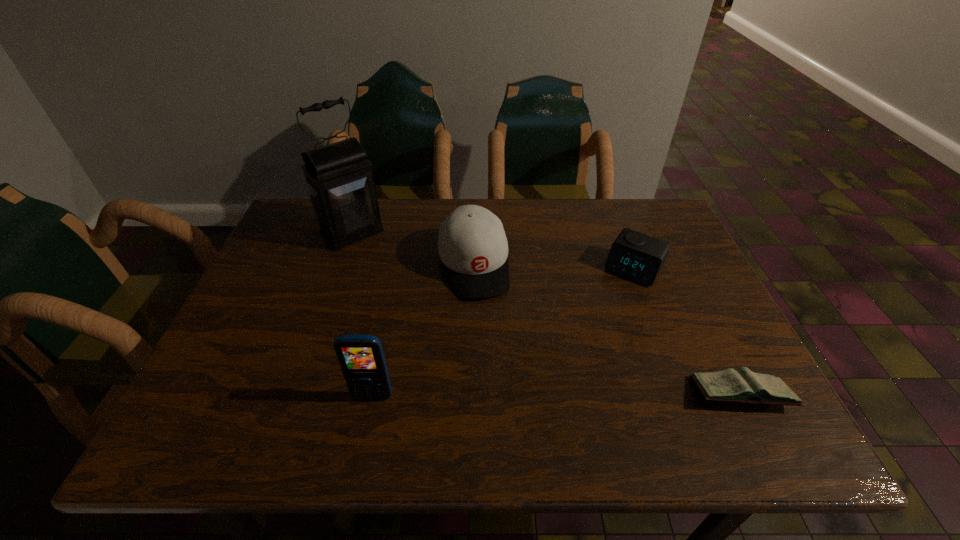
Where is `cellular telephone at the near edge`? This screenshot has width=960, height=540. cellular telephone at the near edge is located at coordinates (361, 357).

This screenshot has height=540, width=960. Find the location of `diary at the near edge`. diary at the near edge is located at coordinates (743, 386).

Where is `object positioned at the left edge`? This screenshot has height=540, width=960. object positioned at the left edge is located at coordinates pyautogui.click(x=340, y=183).

The width and height of the screenshot is (960, 540). Find the location of `diary present at the right edge`. diary present at the right edge is located at coordinates (743, 386).

You are a GUI agent. You are given a task and a screenshot of the screen. Output one action in this format:
    pyautogui.click(x=<x>, y=<y>)
    Task: Click on the alarm clock that is at the right edge
    The image size is (960, 540).
    Given the screenshot: What is the action you would take?
    pyautogui.click(x=633, y=255)

The width and height of the screenshot is (960, 540). Identify the location of object that is at the far left corner. (340, 183).

Locate an element on the screen. This screenshot has width=960, height=540. object situated at the near right corner is located at coordinates (743, 386).

Where is `vacant space at the far edge of the desktop`? vacant space at the far edge of the desktop is located at coordinates (554, 241).

At what (x,y) coordinates should I click in order to perform the action: click on vacant position at the left edge of the desktop. Please return your answer as a coordinate pair (x, y). Looking at the image, I should click on (262, 292).

At what (x,y) coordinates should I click in order to perform the action: click on vacant position at the right edge of the desktop. Please return your answer as a coordinate pair (x, y). Image resolution: width=960 pixels, height=540 pixels. Looking at the image, I should click on [687, 254].